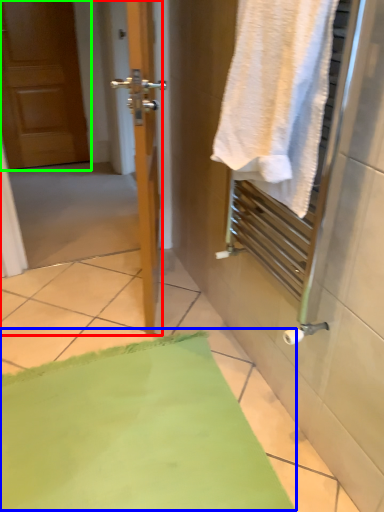
Question: Which object is the closest to the screen door (highlighted by a red box)? Choose among these: bath mat (highlighted by a blue box) or door (highlighted by a green box).

Choices:
 (A) bath mat
 (B) door

Answer: (A)